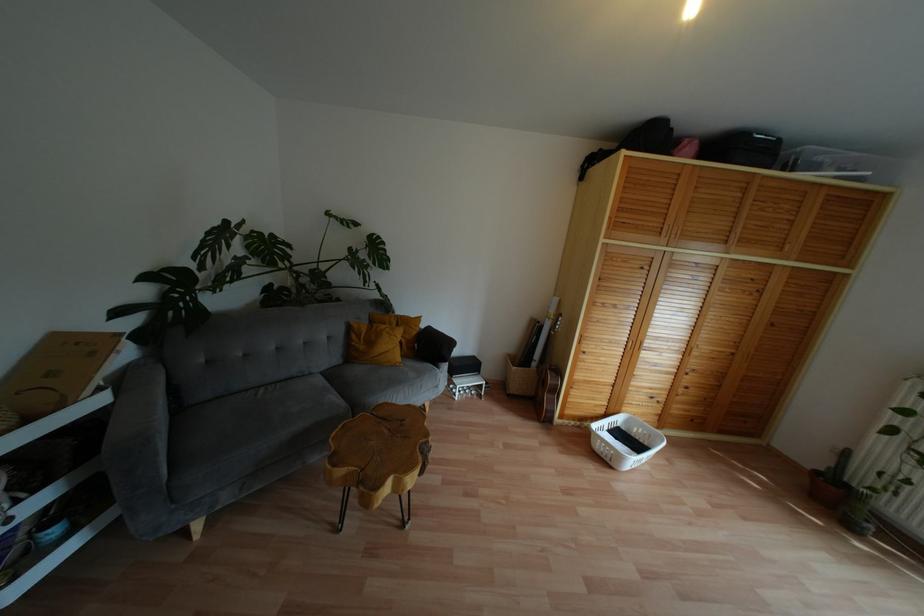
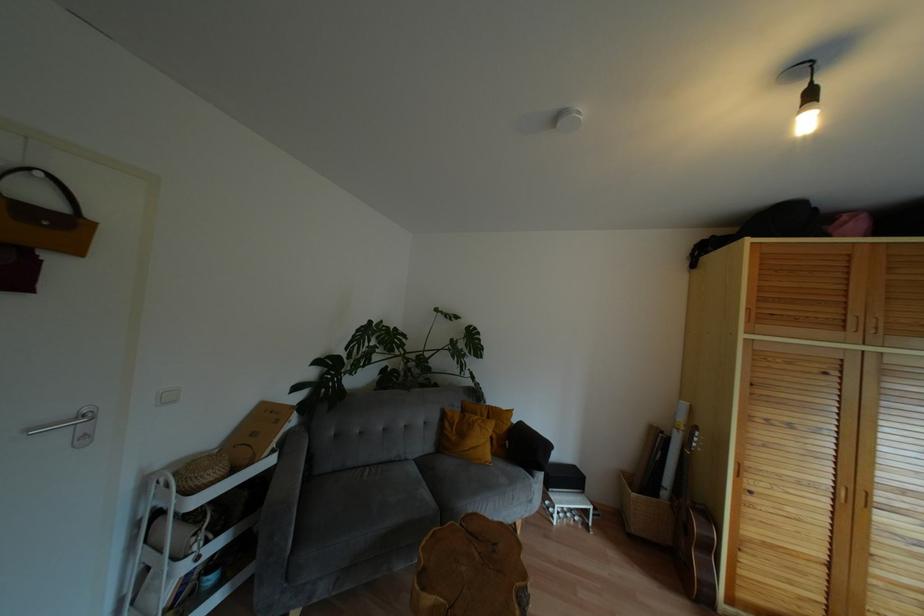
Where in the second image is the point corresponding to pixel 554 391 from the first image?

(710, 548)